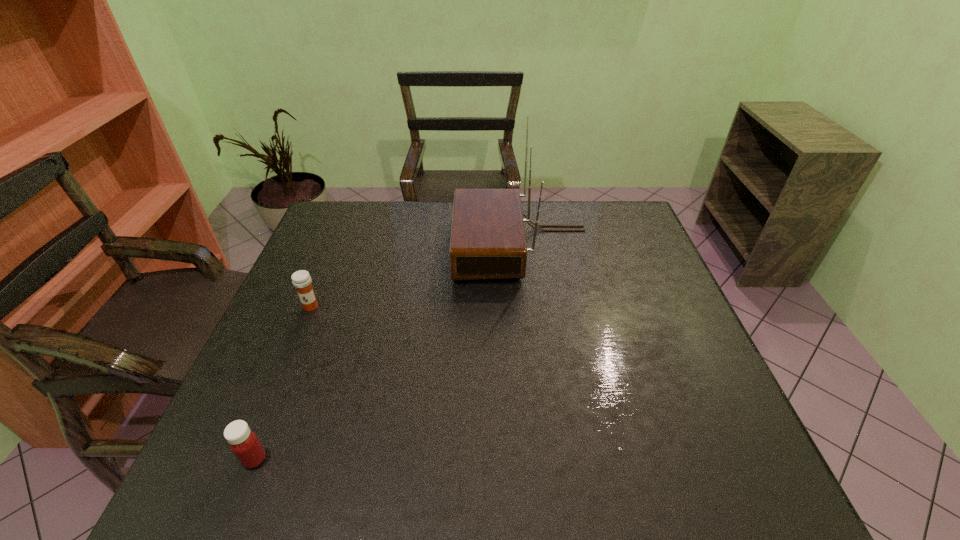
The height and width of the screenshot is (540, 960). In order to click on object present at the near edge in this screenshot , I will do `click(244, 443)`.

The height and width of the screenshot is (540, 960). Find the location of `object that is at the near left corner`. object that is at the near left corner is located at coordinates (244, 443).

At what (x,y) coordinates should I click in order to perform the action: click on vacant region at the far edge. Please return your answer as a coordinate pair (x, y). This screenshot has width=960, height=540. Looking at the image, I should click on (380, 218).

Identify the location of vacant space at the near edge of the desktop. (353, 492).

In the image, there is a desktop. At what (x,y) coordinates should I click in order to perform the action: click on vacant space at the right edge. Please return your answer as a coordinate pair (x, y). Looking at the image, I should click on (632, 261).

Identify the location of vacant space at the far left corner of the desktop. (335, 224).

The width and height of the screenshot is (960, 540). Find the location of `vacant space at the far right corner of the desktop`. vacant space at the far right corner of the desktop is located at coordinates (635, 210).

In the image, there is a desktop. Identify the location of free space at the near right corner. The height and width of the screenshot is (540, 960). (721, 461).

Image resolution: width=960 pixels, height=540 pixels. I want to click on free spot between the second nearest object and the nearer medicine, so click(282, 383).

This screenshot has height=540, width=960. Find the location of `vacant region between the second nearest object and the nearer medicine`. vacant region between the second nearest object and the nearer medicine is located at coordinates pyautogui.click(x=282, y=383).